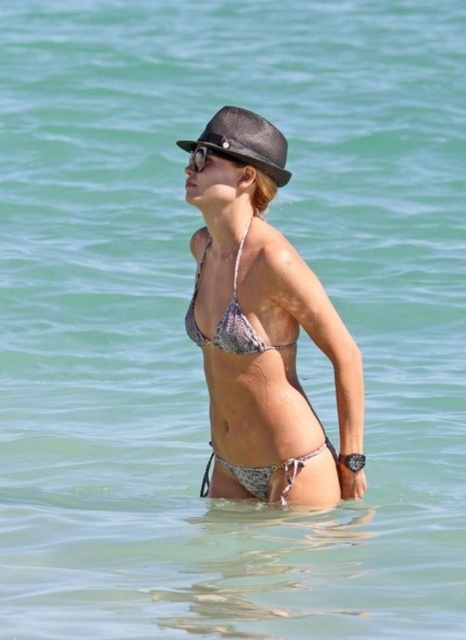
Can you confirm if matte black fedora at upper center is shorter than black textured sunglasses at upper center?

No, matte black fedora at upper center is not shorter than black textured sunglasses at upper center.

Which is above, matte black fedora at upper center or black textured sunglasses at upper center?

matte black fedora at upper center

What are the coordinates of `matte black fedora at upper center` in the screenshot? It's located at (245, 141).

Locate an element on the screen. The width and height of the screenshot is (466, 640). matte black fedora at upper center is located at coordinates point(245,141).

This screenshot has height=640, width=466. Describe the element at coordinates (265, 330) in the screenshot. I see `printed bikini at center` at that location.

Who is more forward, (267, 300) or (242, 157)?

Point (267, 300)

Locate an element on the screen. printed bikini at center is located at coordinates (265, 330).

Is printed fabric bikini top at center to the right of black textured sunglasses at upper center from the viewer's perspective?

Yes, printed fabric bikini top at center is to the right of black textured sunglasses at upper center.

Image resolution: width=466 pixels, height=640 pixels. Find the location of `printed fabric bikini top at center`. printed fabric bikini top at center is located at coordinates (227, 317).

Is point (226, 307) farther from viewer compared to point (201, 145)?

No, it is in front of (201, 145).

Identify the location of printed fabric bikini top at center. (227, 317).